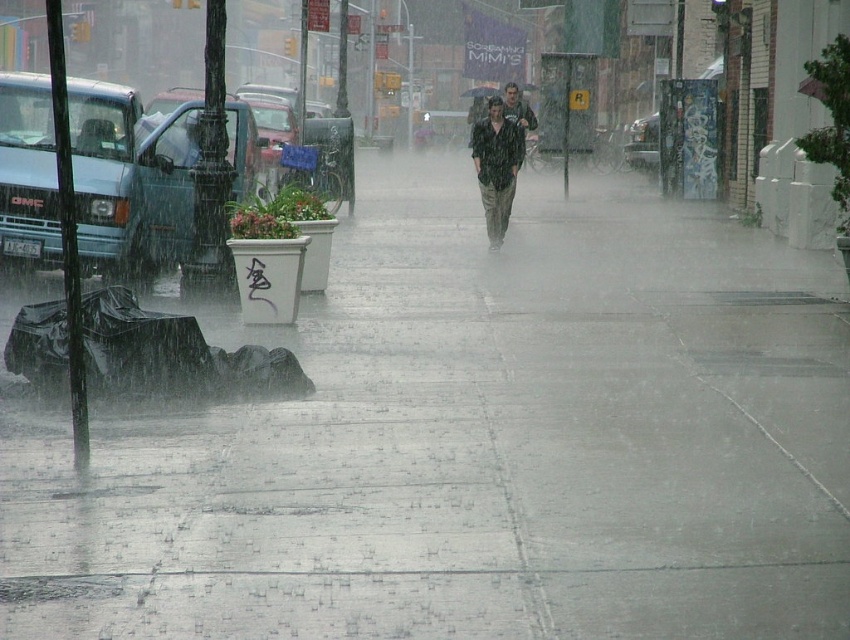
You are standing on the sidewalk in the rainy urban street scene. You notice two points marked on the ground. One is at coordinates point (516, 164) and the other at point (479, 88). Which point is closer to you?

Point (516, 164) is closer to the viewer than point (479, 88).

You are a pedestrian holding a transparent plastic umbrella at center and wearing a matte black shirt at center. A car splashes water from the wet pavement. Which item is more likely to get wet first?

The matte black shirt at center is more likely to get wet first because it is positioned on the left side of the transparent plastic umbrella at center, so the umbrella does not cover it as effectively.